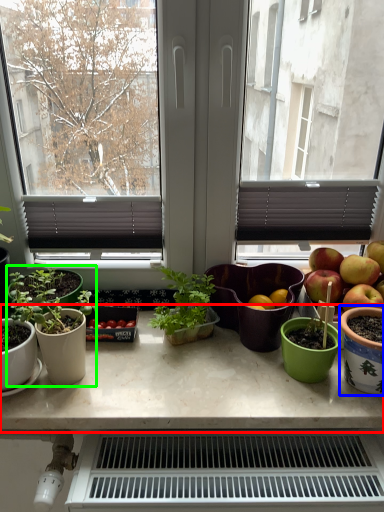
Question: Considering the real-world distances, which object is closest to table (highlighted by a red box)? flowerpot (highlighted by a blue box) or houseplant (highlighted by a green box).

Choices:
 (A) flowerpot
 (B) houseplant

Answer: (B)